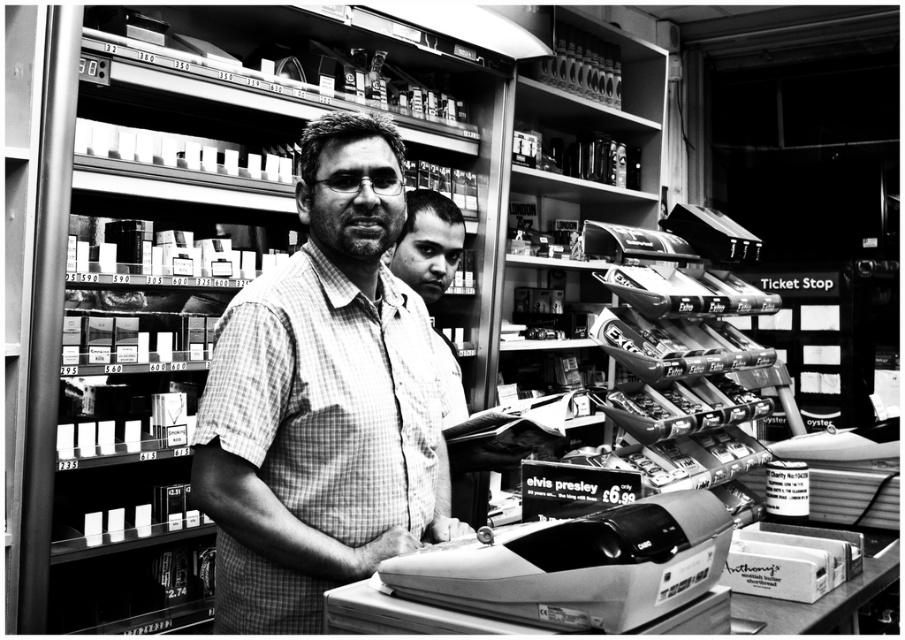
Question: Which point is farther to the camera?

Choices:
 (A) (255, 314)
 (B) (378, 577)

Answer: (A)

Question: Which point appears farthest from the camera in this image?

Choices:
 (A) (301, 154)
 (B) (634, 595)

Answer: (A)

Question: Can you confirm if checkered fabric shirt at center is positioned to the right of metallic gray cash register at lower center?

Choices:
 (A) no
 (B) yes

Answer: (A)

Question: Is checkered fabric shirt at center below metallic gray cash register at lower center?

Choices:
 (A) no
 (B) yes

Answer: (A)

Question: Where is checkered fabric shirt at center located in relation to metallic gray cash register at lower center in the image?

Choices:
 (A) below
 (B) above

Answer: (B)